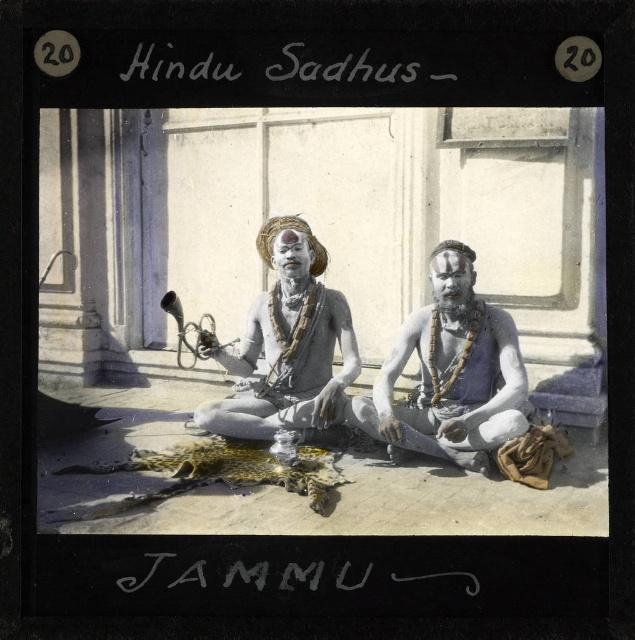
Question: Among these objects, which one is farthest from the camera?

Choices:
 (A) white matte man at center
 (B) white matte statue at center

Answer: (B)

Question: Can you confirm if white matte man at center is positioned to the right of white matte statue at center?

Choices:
 (A) no
 (B) yes

Answer: (B)

Question: Among these objects, which one is farthest from the camera?

Choices:
 (A) white matte man at center
 (B) white matte statue at center

Answer: (B)

Question: Is white matte man at center closer to camera compared to white matte statue at center?

Choices:
 (A) yes
 (B) no

Answer: (A)

Question: Does white matte man at center have a greater width compared to white matte statue at center?

Choices:
 (A) yes
 (B) no

Answer: (A)